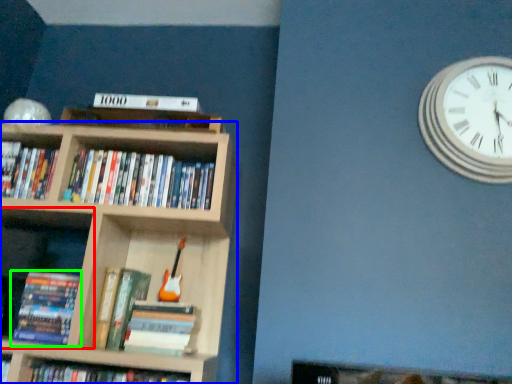
Question: Considering the real-world distances, which object is farthest from shelf (highlighted by a red box)? bookcase (highlighted by a blue box) or book (highlighted by a green box)?

Choices:
 (A) bookcase
 (B) book

Answer: (A)